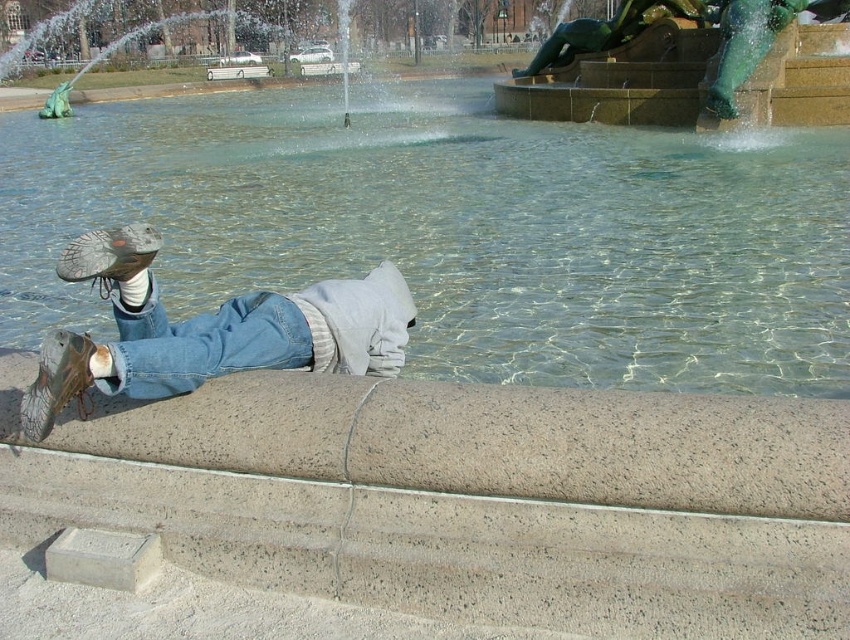
You are taking a photo of the person lying on the concrete ledge near the fountain. You want to focus on the point closer to the camera. Which point should you focus on, point [357,340] or point [165,339]?

Point [357,340] is further to the camera than point [165,339]. Therefore, to focus on the point closer to the camera, you should choose point [165,339].

You are a photographer trying to capture the person on the concrete ledge. You notice two points in your viewfinder labeled as point 1 at coordinates point (x=411, y=324) and point 2 at coordinates point (x=758, y=8). Which point is closer to the camera?

Point (x=411, y=324) is closer to the camera than point (x=758, y=8).